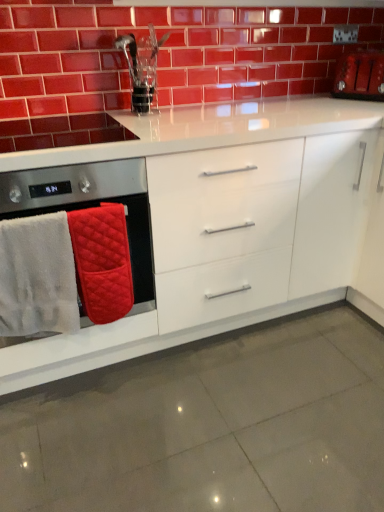
This screenshot has width=384, height=512. Identify the location of matte red toaster at upper right. (360, 75).

Image resolution: width=384 pixels, height=512 pixels. Identify the location of quilted fabric oven mitts at left. (90, 206).

Measure the distance between white fluffy bath towel at left, the first bath towel in the left-to-right sequence, and camera.

4.02 feet.

Where is `white glossy cabinet at center`? This screenshot has width=384, height=512. white glossy cabinet at center is located at coordinates (234, 224).

Identify the location of red quilted bath towel at left, positioned as the 2th bath towel in left-to-right order. Image resolution: width=384 pixels, height=512 pixels. (102, 261).

What do you see at coordinates (158, 61) in the screenshot?
I see `glossy ceramic brickwork at upper center` at bounding box center [158, 61].

Locate an element on the screen. The image size is (384, 512). matte red toaster at upper right is located at coordinates (360, 75).

Considering the positions of point (220, 249) and point (9, 177), is point (220, 249) closer or farther from the camera than point (9, 177)?

Point (220, 249).

Is white glossy cabinet at center positioned far away from quilted fabric oven mitts at left?

No, white glossy cabinet at center is in close proximity to quilted fabric oven mitts at left.

From a real-world perspective, between white glossy cabinet at center and quilted fabric oven mitts at left, who is vertically higher?

quilted fabric oven mitts at left.

Based on the photo, from the image's perspective, would you say white glossy cabinet at center is positioned over quilted fabric oven mitts at left?

Yes, from the image's perspective, white glossy cabinet at center is on top of quilted fabric oven mitts at left.

From the white glossy cabinet at center, count the 2nd bath towel to the left and point to it. Please provide its 2D coordinates.

[(37, 277)]

Considering the relative sizes of white fluffy bath towel at left, the first bath towel in the left-to-right sequence, and white glossy cabinet at center in the image provided, is white fluffy bath towel at left, the first bath towel in the left-to-right sequence, bigger than white glossy cabinet at center?

Actually, white fluffy bath towel at left, the first bath towel in the left-to-right sequence, might be smaller than white glossy cabinet at center.

From a real-world perspective, relative to white glossy cabinet at center, is white fluffy bath towel at left, the 2th bath towel viewed from the right, vertically above or below?

Answer: Clearly, from a real-world perspective, white fluffy bath towel at left, the 2th bath towel viewed from the right, is above white glossy cabinet at center.

Can you tell me how much white fluffy bath towel at left, the first bath towel in the left-to-right sequence, and white glossy cabinet at center differ in facing direction?

The angular difference between white fluffy bath towel at left, the first bath towel in the left-to-right sequence, and white glossy cabinet at center is 3.42 degrees.

From the image's perspective, is matte red toaster at upper right located beneath quilted fabric oven mitts at left?

Actually, matte red toaster at upper right appears above quilted fabric oven mitts at left in the image.

From a real-world perspective, does matte red toaster at upper right stand above quilted fabric oven mitts at left?

Yes.

Is matte red toaster at upper right positioned with its back to quilted fabric oven mitts at left?

matte red toaster at upper right is not turned away from quilted fabric oven mitts at left.

Does point (361, 82) come in front of point (135, 185)?

No, (361, 82) is behind (135, 185).

In the scene shown: From the image's perspective, which one is positioned higher, glossy ceramic brickwork at upper center or white fluffy bath towel at left, the first bath towel in the left-to-right sequence?

glossy ceramic brickwork at upper center, from the image's perspective.

Considering the sizes of objects glossy ceramic brickwork at upper center and white fluffy bath towel at left, the 2th bath towel viewed from the right, in the image provided, who is taller, glossy ceramic brickwork at upper center or white fluffy bath towel at left, the 2th bath towel viewed from the right,?

glossy ceramic brickwork at upper center.

What are the coordinates of `brickwork that appears above the white fluffy bath towel at left, the first bath towel in the left-to-right sequence (from the image's perspective)` in the screenshot? It's located at (158, 61).

Based on the photo, is glossy ceramic brickwork at upper center in contact with white fluffy bath towel at left, the first bath towel in the left-to-right sequence?

glossy ceramic brickwork at upper center and white fluffy bath towel at left, the first bath towel in the left-to-right sequence, are clearly separated.

Measure the distance from white glossy cabinet at center to white fluffy bath towel at left, the 2th bath towel viewed from the right.

The distance of white glossy cabinet at center from white fluffy bath towel at left, the 2th bath towel viewed from the right, is 19.23 inches.

Locate an element on the screen. This screenshot has width=384, height=512. cabinetry below the white fluffy bath towel at left, the 2th bath towel viewed from the right (from a real-world perspective) is located at coordinates (234, 224).

Does white glossy cabinet at center appear on the right side of white fluffy bath towel at left, the first bath towel in the left-to-right sequence?

Indeed, white glossy cabinet at center is positioned on the right side of white fluffy bath towel at left, the first bath towel in the left-to-right sequence.

Is white glossy cabinet at center in contact with white fluffy bath towel at left, the 2th bath towel viewed from the right?

No.

Can you confirm if red quilted bath towel at left, which is the first bath towel in right-to-left order, is wider than matte red toaster at upper right?

In fact, red quilted bath towel at left, which is the first bath towel in right-to-left order, might be narrower than matte red toaster at upper right.

Who is taller, red quilted bath towel at left, which is the first bath towel in right-to-left order, or matte red toaster at upper right?

Standing taller between the two is red quilted bath towel at left, which is the first bath towel in right-to-left order.

Would you say red quilted bath towel at left, which is the first bath towel in right-to-left order, is inside or outside matte red toaster at upper right?

red quilted bath towel at left, which is the first bath towel in right-to-left order, is located beyond the bounds of matte red toaster at upper right.

Is red quilted bath towel at left, positioned as the 2th bath towel in left-to-right order, aimed at matte red toaster at upper right?

No, red quilted bath towel at left, positioned as the 2th bath towel in left-to-right order, is not oriented towards matte red toaster at upper right.

Measure the distance from red quilted bath towel at left, positioned as the 2th bath towel in left-to-right order, to white glossy cabinet at center.

red quilted bath towel at left, positioned as the 2th bath towel in left-to-right order, is 16.25 inches from white glossy cabinet at center.

I want to click on cabinetry located on the right of red quilted bath towel at left, which is the first bath towel in right-to-left order, so click(234, 224).

Is red quilted bath towel at left, which is the first bath towel in right-to-left order, far from white glossy cabinet at center?

red quilted bath towel at left, which is the first bath towel in right-to-left order, is actually quite close to white glossy cabinet at center.

Does red quilted bath towel at left, which is the first bath towel in right-to-left order, contain white glossy cabinet at center?

Actually, white glossy cabinet at center is outside red quilted bath towel at left, which is the first bath towel in right-to-left order.

Where is `home appliance above the white glossy cabinet at center (from a real-world perspective)`? home appliance above the white glossy cabinet at center (from a real-world perspective) is located at coordinates (90, 206).

Identify the location of cabinetry above the white fluffy bath towel at left, the 2th bath towel viewed from the right (from the image's perspective). click(234, 224).

Considering their positions, is glossy ceramic brickwork at upper center positioned further to red quilted bath towel at left, which is the first bath towel in right-to-left order, than quilted fabric oven mitts at left?

The object further to red quilted bath towel at left, which is the first bath towel in right-to-left order, is glossy ceramic brickwork at upper center.

Based on their spatial positions, is white fluffy bath towel at left, the first bath towel in the left-to-right sequence, or glossy ceramic brickwork at upper center further from red quilted bath towel at left, which is the first bath towel in right-to-left order?

Among the two, glossy ceramic brickwork at upper center is located further to red quilted bath towel at left, which is the first bath towel in right-to-left order.

Based on their spatial positions, is quilted fabric oven mitts at left or glossy ceramic brickwork at upper center further from white fluffy bath towel at left, the 2th bath towel viewed from the right?

glossy ceramic brickwork at upper center is positioned further to the anchor white fluffy bath towel at left, the 2th bath towel viewed from the right.

Which object lies further to the anchor point red quilted bath towel at left, which is the first bath towel in right-to-left order, quilted fabric oven mitts at left or matte red toaster at upper right?

Among the two, matte red toaster at upper right is located further to red quilted bath towel at left, which is the first bath towel in right-to-left order.

In the scene shown: Estimate the real-world distances between objects in this image. Which object is closer to quilted fabric oven mitts at left, matte red toaster at upper right or glossy ceramic brickwork at upper center?

glossy ceramic brickwork at upper center.

Based on their spatial positions, is white fluffy bath towel at left, the 2th bath towel viewed from the right, or red quilted bath towel at left, positioned as the 2th bath towel in left-to-right order, closer to glossy ceramic brickwork at upper center?

The object closer to glossy ceramic brickwork at upper center is red quilted bath towel at left, positioned as the 2th bath towel in left-to-right order.

Estimate the real-world distances between objects in this image. Which object is closer to white glossy cabinet at center, quilted fabric oven mitts at left or red quilted bath towel at left, positioned as the 2th bath towel in left-to-right order?

quilted fabric oven mitts at left.

Which object lies further to the anchor point glossy ceramic brickwork at upper center, white fluffy bath towel at left, the first bath towel in the left-to-right sequence, or white glossy cabinet at center?

Among the two, white fluffy bath towel at left, the first bath towel in the left-to-right sequence, is located further to glossy ceramic brickwork at upper center.

The image size is (384, 512). Find the location of `cabinetry situated between white fluffy bath towel at left, the 2th bath towel viewed from the right, and matte red toaster at upper right from left to right`. cabinetry situated between white fluffy bath towel at left, the 2th bath towel viewed from the right, and matte red toaster at upper right from left to right is located at coordinates (234, 224).

Where is `brickwork located between quilted fabric oven mitts at left and matte red toaster at upper right in the left-right direction`? brickwork located between quilted fabric oven mitts at left and matte red toaster at upper right in the left-right direction is located at coordinates (158, 61).

Where is `bath towel between white fluffy bath towel at left, the 2th bath towel viewed from the right, and matte red toaster at upper right, in the horizontal direction`? The width and height of the screenshot is (384, 512). bath towel between white fluffy bath towel at left, the 2th bath towel viewed from the right, and matte red toaster at upper right, in the horizontal direction is located at coordinates (102, 261).

Find the location of a particular element. This screenshot has width=384, height=512. bath towel between glossy ceramic brickwork at upper center and white fluffy bath towel at left, the 2th bath towel viewed from the right, from top to bottom is located at coordinates (102, 261).